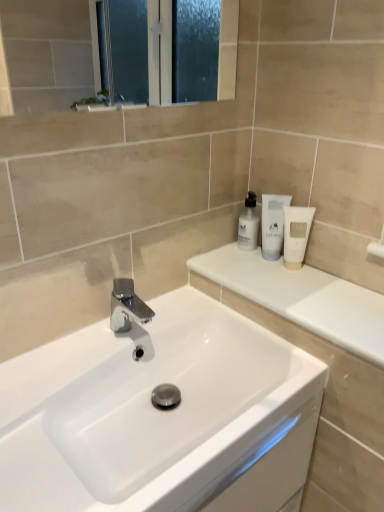
Question: Looking at their shapes, would you say white matte tube at upper right, placed as the first toiletry when sorted from right to left, is wider or thinner than white glossy sink at center?

Choices:
 (A) thin
 (B) wide

Answer: (A)

Question: Based on their positions, is white matte tube at upper right, placed as the first toiletry when sorted from right to left, located to the left or right of white glossy sink at center?

Choices:
 (A) right
 (B) left

Answer: (A)

Question: Which is nearer to the white glossy lotion at upper right, positioned as the third toiletry in right-to-left order?

Choices:
 (A) polished chrome tap at center
 (B) white glossy sink at center
 (C) white glossy lotion at upper right, arranged as the 2th toiletry when viewed from the left
 (D) white glossy countertop at upper right
 (E) white matte tube at upper right, the third toiletry viewed from the left

Answer: (C)

Question: Which object is the closest to the white matte tube at upper right, placed as the first toiletry when sorted from right to left?

Choices:
 (A) white glossy lotion at upper right, positioned as the third toiletry in right-to-left order
 (B) white glossy countertop at upper right
 (C) white glossy lotion at upper right, which is the 2th toiletry in right-to-left order
 (D) white glossy sink at center
 (E) polished chrome tap at center

Answer: (C)